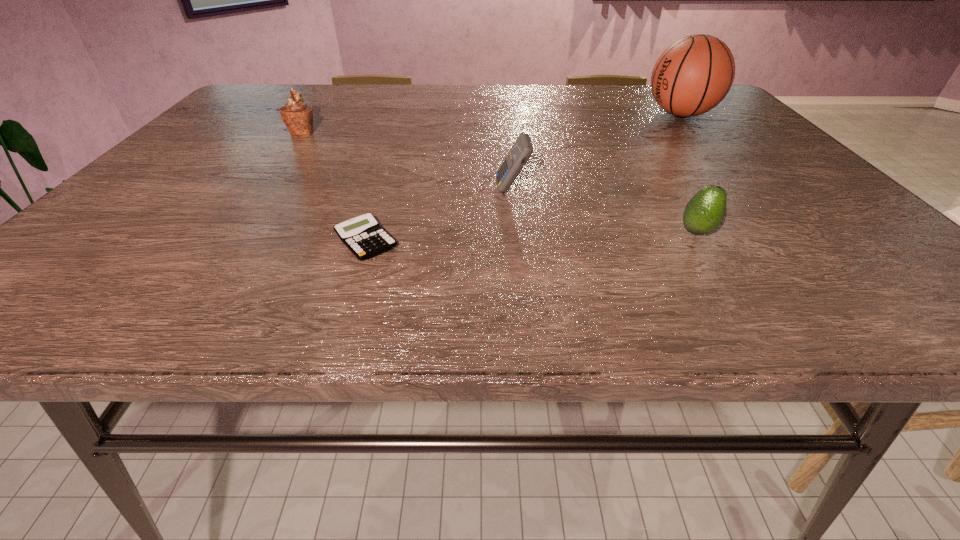
Identify the location of the rightmost object. Image resolution: width=960 pixels, height=540 pixels. (693, 75).

Where is `basketball`? basketball is located at coordinates (693, 75).

Identify the location of the right calculator. Image resolution: width=960 pixels, height=540 pixels. (522, 149).

Image resolution: width=960 pixels, height=540 pixels. I want to click on the third nearest object, so click(522, 149).

Where is `the leftmost object`? Image resolution: width=960 pixels, height=540 pixels. the leftmost object is located at coordinates (298, 117).

Find the location of `the second shortest object`. the second shortest object is located at coordinates (705, 211).

Locate an element on the screen. avocado is located at coordinates click(705, 211).

You are a GUI agent. You are given a task and a screenshot of the screen. Output one action in this format:
    pyautogui.click(x=<x>, y=<y>)
    Task: Click on the fourth object from right to left
    
    Given the screenshot: What is the action you would take?
    pyautogui.click(x=363, y=235)

The height and width of the screenshot is (540, 960). Find the location of `the shortest object`. the shortest object is located at coordinates coord(363,235).

What are the coordinates of `vacant region located 0.350m on the surface of the rightmost object near the brand logo` in the screenshot? It's located at (521, 114).